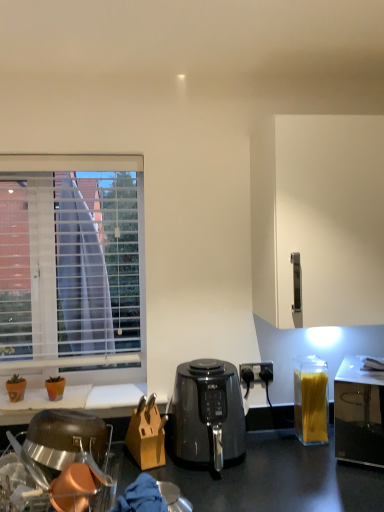
Image resolution: width=384 pixels, height=512 pixels. In order to click on vacant space underneath white blinds at left (from a real-world perspective) in this screenshot , I will do `click(51, 388)`.